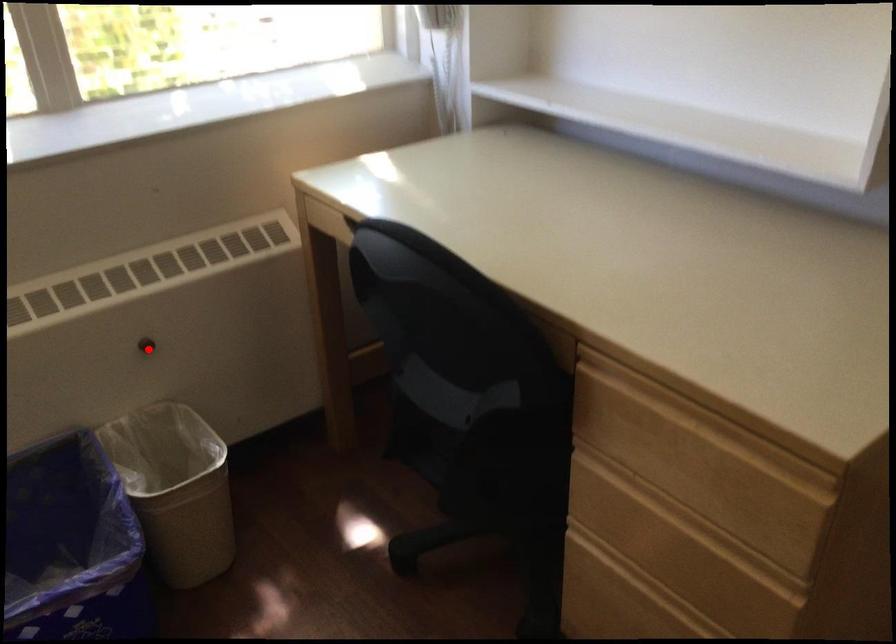
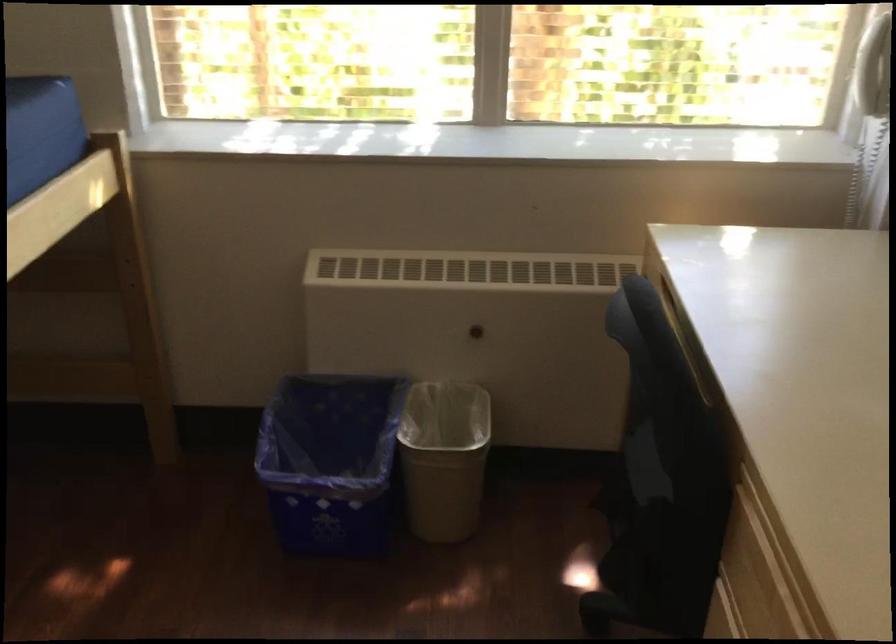
Locate, in the second image, the point that corresponds to the highlighted location in the first image.

(476, 330)